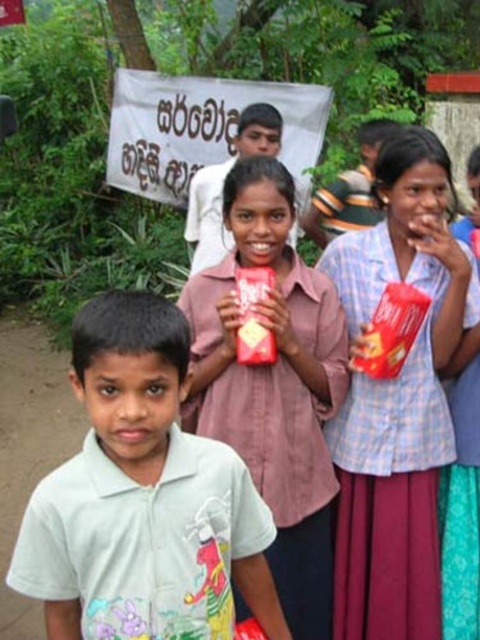
You are a photographer trying to capture a clear shot of the matte pink shirt at center and the matte plastic cup at right. Since the banner in the background has text, you want to ensure neither object is covering the text. Which object should you adjust to avoid blocking the banner text?

The matte pink shirt at center is bigger than the matte plastic cup at right, so you should adjust the position of the matte pink shirt at center to prevent it from covering the banner text.

You are a photographer setting up for a group photo. You have a matte plastic cup at right and a matte plastic boy at center in your frame. Which object is narrower in width?

The matte plastic cup at right is thinner than the matte plastic boy at center, so the matte plastic cup at right is narrower in width.

You are organizing a picnic and need to determine seating arrangements. You have a bench that can accommodate items up to the width of the matte plastic cup at right. Can the matte pink shirt at center fit on the bench?

The matte pink shirt at center is wider than the matte plastic cup at right, so it cannot fit on the bench designed for the cup.